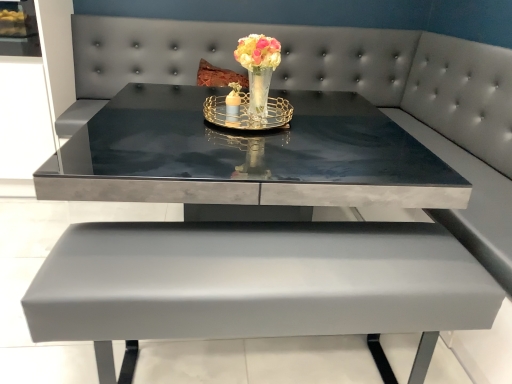
Question: Is gold metallic tray at center inside the boundaries of glossy concrete table at center, or outside?

Choices:
 (A) outside
 (B) inside

Answer: (A)

Question: From the image's perspective, relative to glossy concrete table at center, is gold metallic tray at center above or below?

Choices:
 (A) above
 (B) below

Answer: (A)

Question: Which of these objects is positioned closest to the glossy concrete table at center?

Choices:
 (A) glossy glass vase at center
 (B) gold metallic tray at center

Answer: (B)

Question: Estimate the real-world distances between objects in this image. Which object is closer to the glossy concrete table at center?

Choices:
 (A) glossy glass vase at center
 (B) gold metallic tray at center

Answer: (B)